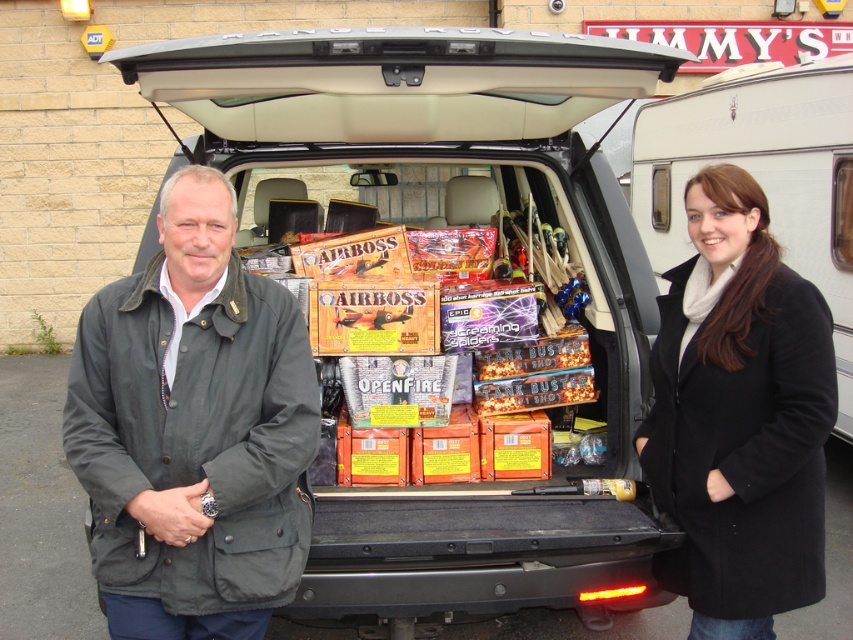
Question: Is black wool coat at lower right in front of white glossy caravan at upper right?

Choices:
 (A) no
 (B) yes

Answer: (B)

Question: Which point is farther to the camera?

Choices:
 (A) (616, 292)
 (B) (207, 429)
 (C) (801, 449)

Answer: (A)

Question: Considering the relative positions of dark green waxed fabric jacket at left and white glossy caravan at upper right in the image provided, where is dark green waxed fabric jacket at left located with respect to white glossy caravan at upper right?

Choices:
 (A) below
 (B) above

Answer: (A)

Question: Which point is closer to the camera taking this photo?

Choices:
 (A) (708, 396)
 (B) (427, 518)
 (C) (636, 150)
 (D) (132, 632)

Answer: (D)

Question: Which point is closer to the camera?

Choices:
 (A) black wool coat at lower right
 (B) dark green waxed fabric jacket at left
 (C) matte black van at center

Answer: (B)

Question: Does matte black van at center appear under white glossy caravan at upper right?

Choices:
 (A) yes
 (B) no

Answer: (A)